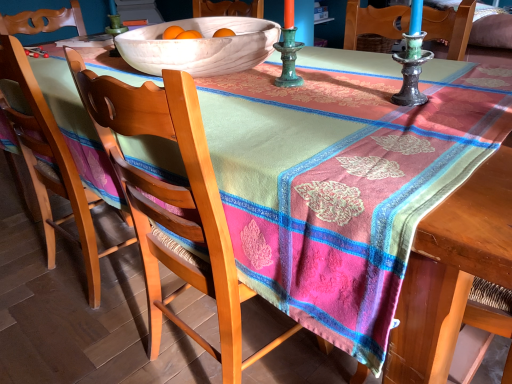
The width and height of the screenshot is (512, 384). What do you see at coordinates (51, 166) in the screenshot? I see `wooden chair at left, which ranks as the second chair in right-to-left order` at bounding box center [51, 166].

At what (x,y) coordinates should I click in order to perform the action: click on wooden chair at center, acting as the 1th chair starting from the right. Please return your answer as a coordinate pair (x, y). The height and width of the screenshot is (384, 512). Looking at the image, I should click on (172, 202).

The image size is (512, 384). Identify the location of white ceramic bowl at upper center. (200, 46).

Does point (145, 28) lie behind point (203, 216)?

That is True.

Is the surface of white ceramic bowl at upper center in direct contact with wooden chair at center, the 2th chair from the left?

white ceramic bowl at upper center and wooden chair at center, the 2th chair from the left, are not in contact.

Is white ceramic bowl at upper center oriented away from wooden chair at center, the 2th chair from the left?

No, white ceramic bowl at upper center is not facing the opposite direction of wooden chair at center, the 2th chair from the left.

Is wooden chair at left, positioned as the 1th chair in left-to-right order, placed right next to wooden chair at center, acting as the 1th chair starting from the right?

wooden chair at left, positioned as the 1th chair in left-to-right order, and wooden chair at center, acting as the 1th chair starting from the right, are clearly separated.

Does wooden chair at left, positioned as the 1th chair in left-to-right order, come in front of wooden chair at center, the 2th chair from the left?

No, it is not.

Is wooden chair at left, which ranks as the second chair in right-to-left order, aimed at wooden chair at center, the 2th chair from the left?

No, wooden chair at left, which ranks as the second chair in right-to-left order, is not turned towards wooden chair at center, the 2th chair from the left.

Is wooden chair at left, positioned as the 1th chair in left-to-right order, in front of or behind white ceramic bowl at upper center in the image?

Clearly, wooden chair at left, positioned as the 1th chair in left-to-right order, is behind white ceramic bowl at upper center.

Who is taller, wooden chair at left, which ranks as the second chair in right-to-left order, or white ceramic bowl at upper center?

Standing taller between the two is wooden chair at left, which ranks as the second chair in right-to-left order.

Is point (58, 180) closer to camera compared to point (247, 42)?

No, (58, 180) is behind (247, 42).

Is wooden chair at left, which ranks as the second chair in right-to-left order, placed right next to white ceramic bowl at upper center?

wooden chair at left, which ranks as the second chair in right-to-left order, is not next to white ceramic bowl at upper center, and they're not touching.

In terms of size, does wooden chair at center, the 2th chair from the left, appear bigger or smaller than white ceramic bowl at upper center?

In the image, wooden chair at center, the 2th chair from the left, appears to be larger than white ceramic bowl at upper center.

Based on the photo, is wooden chair at center, the 2th chair from the left, next to white ceramic bowl at upper center and touching it?

No, wooden chair at center, the 2th chair from the left, is not next to white ceramic bowl at upper center.

Which of these two, wooden chair at center, the 2th chair from the left, or white ceramic bowl at upper center, is thinner?

Thinner between the two is wooden chair at center, the 2th chair from the left.

Relative to white ceramic bowl at upper center, is wooden chair at center, the 2th chair from the left, in front or behind?

wooden chair at center, the 2th chair from the left, is positioned closer to the viewer than white ceramic bowl at upper center.

Which point is more distant from viewer, (x=118, y=153) or (x=13, y=112)?

The point (x=13, y=112) is more distant.

From a real-world perspective, is wooden chair at center, acting as the 1th chair starting from the right, above or below wooden chair at left, which ranks as the second chair in right-to-left order?

From a real-world perspective, wooden chair at center, acting as the 1th chair starting from the right, is physically below wooden chair at left, which ranks as the second chair in right-to-left order.

Is wooden chair at center, the 2th chair from the left, bigger than wooden chair at left, positioned as the 1th chair in left-to-right order?

Indeed, wooden chair at center, the 2th chair from the left, has a larger size compared to wooden chair at left, positioned as the 1th chair in left-to-right order.

Looking at their sizes, would you say white ceramic bowl at upper center is wider or thinner than wooden chair at left, which ranks as the second chair in right-to-left order?

In the image, white ceramic bowl at upper center appears to be wider than wooden chair at left, which ranks as the second chair in right-to-left order.

Considering the relative sizes of white ceramic bowl at upper center and wooden chair at left, which ranks as the second chair in right-to-left order, in the image provided, is white ceramic bowl at upper center bigger than wooden chair at left, which ranks as the second chair in right-to-left order,?

Incorrect, white ceramic bowl at upper center is not larger than wooden chair at left, which ranks as the second chair in right-to-left order.

This screenshot has width=512, height=384. I want to click on the 1st chair below the white ceramic bowl at upper center (from the image's perspective), so click(x=51, y=166).

Looking at this image, considering their positions, is white ceramic bowl at upper center located in front of or behind wooden chair at left, which ranks as the second chair in right-to-left order?

white ceramic bowl at upper center is positioned closer to the viewer than wooden chair at left, which ranks as the second chair in right-to-left order.

Find the location of a particular element. bowl located behind the wooden chair at center, acting as the 1th chair starting from the right is located at coordinates (200, 46).

Identify the location of chair lying on the left of wooden chair at center, the 2th chair from the left. The width and height of the screenshot is (512, 384). (51, 166).

Consider the image. When comparing their distances from wooden chair at center, acting as the 1th chair starting from the right, does wooden chair at left, positioned as the 1th chair in left-to-right order, or white ceramic bowl at upper center seem further?

Based on the image, wooden chair at left, positioned as the 1th chair in left-to-right order, appears to be further to wooden chair at center, acting as the 1th chair starting from the right.

Estimate the real-world distances between objects in this image. Which object is closer to wooden chair at left, which ranks as the second chair in right-to-left order, white ceramic bowl at upper center or wooden chair at center, the 2th chair from the left?

wooden chair at center, the 2th chair from the left.

Considering their positions, is wooden chair at center, acting as the 1th chair starting from the right, positioned closer to white ceramic bowl at upper center than wooden chair at left, positioned as the 1th chair in left-to-right order?

The object closer to white ceramic bowl at upper center is wooden chair at center, acting as the 1th chair starting from the right.

Based on their spatial positions, is wooden chair at center, the 2th chair from the left, or white ceramic bowl at upper center closer to wooden chair at left, which ranks as the second chair in right-to-left order?

Based on the image, wooden chair at center, the 2th chair from the left, appears to be nearer to wooden chair at left, which ranks as the second chair in right-to-left order.

Which object lies nearer to the anchor point wooden chair at center, the 2th chair from the left, white ceramic bowl at upper center or wooden chair at left, which ranks as the second chair in right-to-left order?

white ceramic bowl at upper center lies closer to wooden chair at center, the 2th chair from the left, than the other object.

From the image, which object appears to be farther from white ceramic bowl at upper center, wooden chair at left, which ranks as the second chair in right-to-left order, or wooden chair at center, acting as the 1th chair starting from the right?

Among the two, wooden chair at left, which ranks as the second chair in right-to-left order, is located further to white ceramic bowl at upper center.

Where is `chair between white ceramic bowl at upper center and wooden chair at center, the 2th chair from the left, in the up-down direction`? chair between white ceramic bowl at upper center and wooden chair at center, the 2th chair from the left, in the up-down direction is located at coordinates (51, 166).